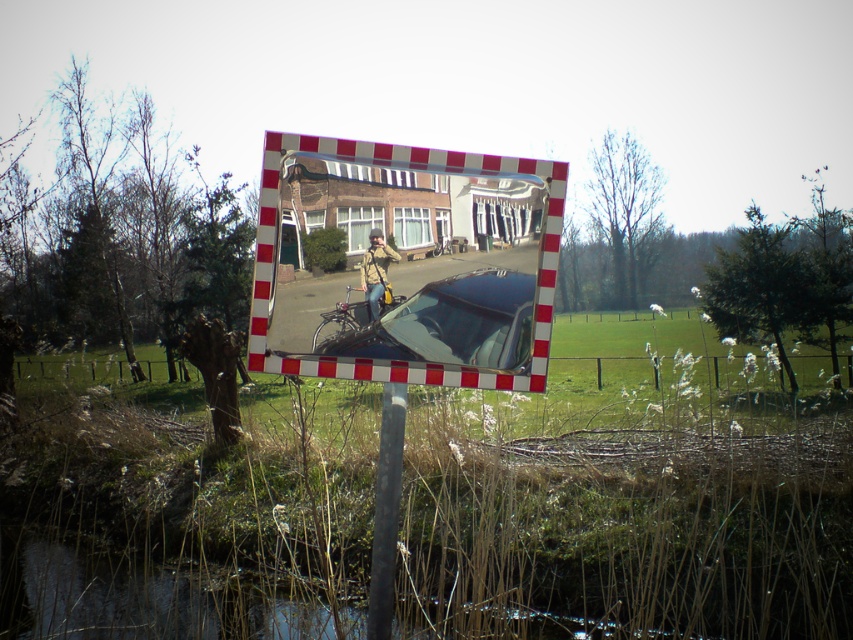
Is reflective glass mirror at center wider than matte black car at center?

Yes.

Is the position of reflective glass mirror at center less distant than that of matte black car at center?

Yes, reflective glass mirror at center is in front of matte black car at center.

The image size is (853, 640). What do you see at coordinates (404, 262) in the screenshot?
I see `reflective glass mirror at center` at bounding box center [404, 262].

Locate an element on the screen. This screenshot has height=640, width=853. reflective glass mirror at center is located at coordinates (404, 262).